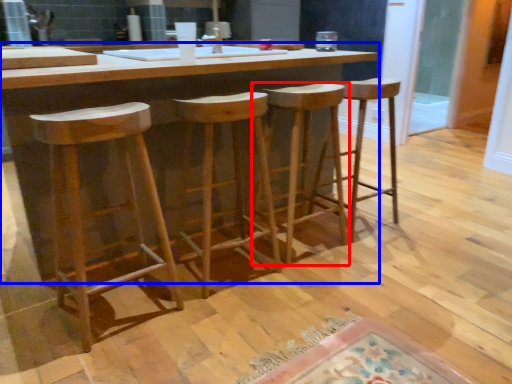
Question: Which of the following is the closest to the observer, stool (highlighted by a red box) or table (highlighted by a blue box)?

Choices:
 (A) stool
 (B) table

Answer: (B)